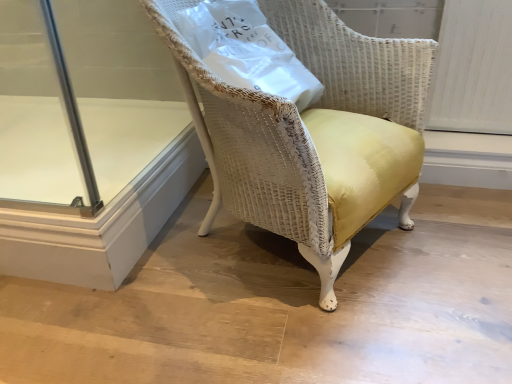
Identify the location of free location in front of yellow fabric chair at center. (300, 334).